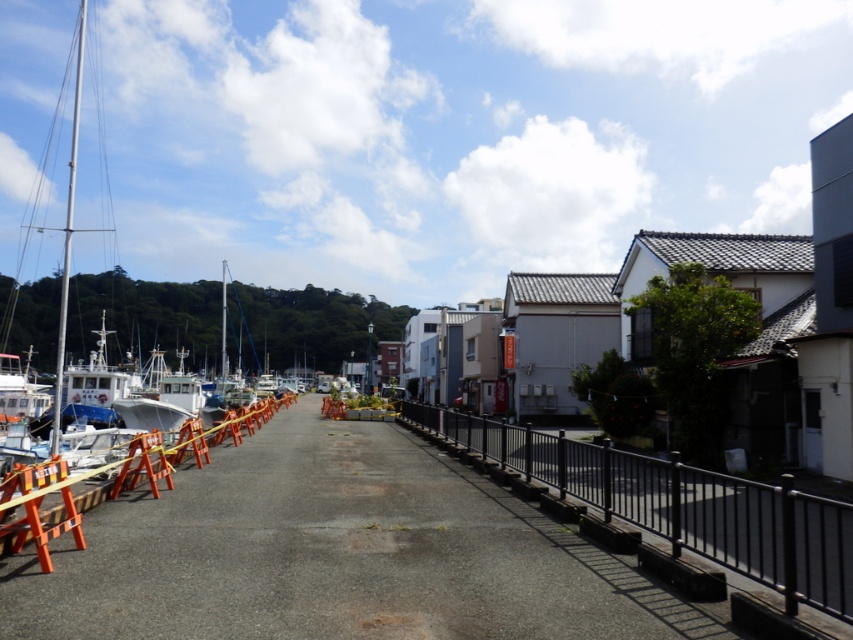
You are standing at point (337, 554) in the waterfront scene. What is the surface material under your feet?

The surface material at point (337, 554) is smooth asphalt path at center.

Based on the photo, you are a delivery person with a cart that is 2 meters wide. You need to move along the smooth asphalt path at center. Can your cart fit on the path without going over the black metal fence at right?

The smooth asphalt path at center is narrower than the black metal fence at right, so the cart may not fit. The path is narrower than the fence, meaning it might be too narrow for a 2m wide cart. The fence is wider, but the path itself is the limiting factor. The cart might need to be narrower or find an alternative route.

You are a delivery person carrying a large package and need to walk along the smooth asphalt path at center. However, there is a black metal fence at right nearby. Can you pass through the path without hitting the fence?

The smooth asphalt path at center has a smaller size compared to black metal fence at right, so you should be cautious as the path is narrower than the fence. Ensure you stay centered to avoid contact with the fence.